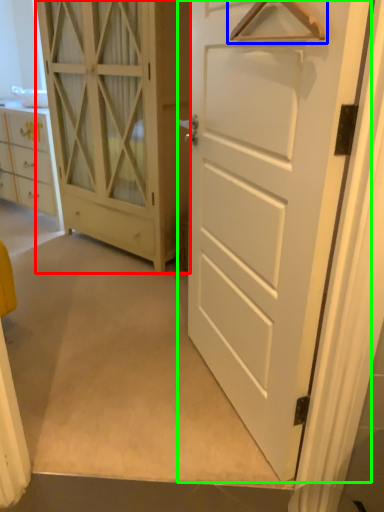
Question: Which object is the farthest from door (highlighted by a red box)? Choose among these: hanger (highlighted by a blue box) or door (highlighted by a green box).

Choices:
 (A) hanger
 (B) door

Answer: (A)